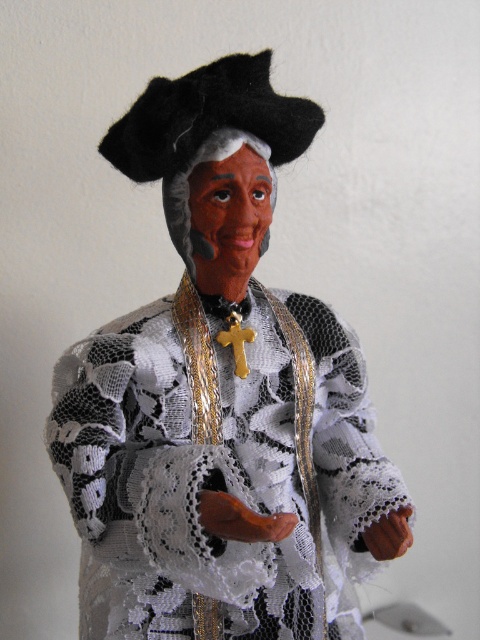
Is point (308, 396) less distant than point (243, 284)?

That is False.

Does white lace dress at center appear on the left side of matte black face at center?

In fact, white lace dress at center is to the right of matte black face at center.

Is point (200, 461) in front of point (226, 195)?

Yes.

Where is `white lace dress at center`? white lace dress at center is located at coordinates (220, 401).